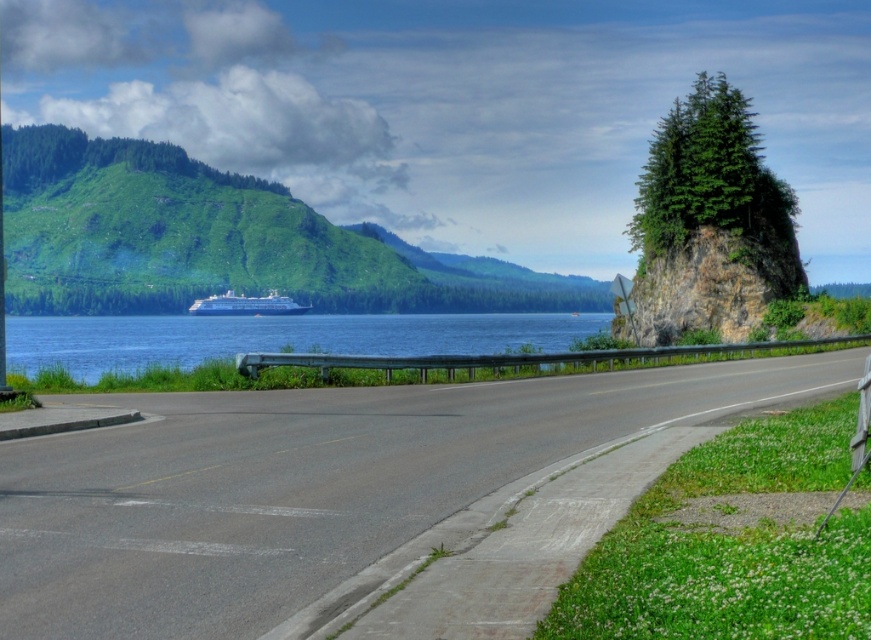
Does asphalt road at center appear under white glossy cruise ship at center?

Correct, asphalt road at center is located below white glossy cruise ship at center.

Is point (71, 566) in front of point (235, 298)?

Yes.

Which is in front, point (261, 500) or point (301, 308)?

Point (261, 500) is more forward.

Locate an element on the screen. asphalt road at center is located at coordinates (308, 484).

Can you confirm if blue water at center is positioned to the right of metallic reflective sign at upper right?

No, blue water at center is not to the right of metallic reflective sign at upper right.

Between blue water at center and metallic reflective sign at upper right, which one is positioned higher?

Positioned higher is metallic reflective sign at upper right.

This screenshot has width=871, height=640. I want to click on blue water at center, so click(x=275, y=337).

Consider the image. Between white glossy cruise ship at center and metallic reflective sign at upper right, which one has less height?

With less height is white glossy cruise ship at center.

Is white glossy cruise ship at center taller than metallic reflective sign at upper right?

No, white glossy cruise ship at center is not taller than metallic reflective sign at upper right.

Measure the distance between white glossy cruise ship at center and camera.

white glossy cruise ship at center and camera are 191.36 meters apart.

Image resolution: width=871 pixels, height=640 pixels. I want to click on white glossy cruise ship at center, so click(246, 305).